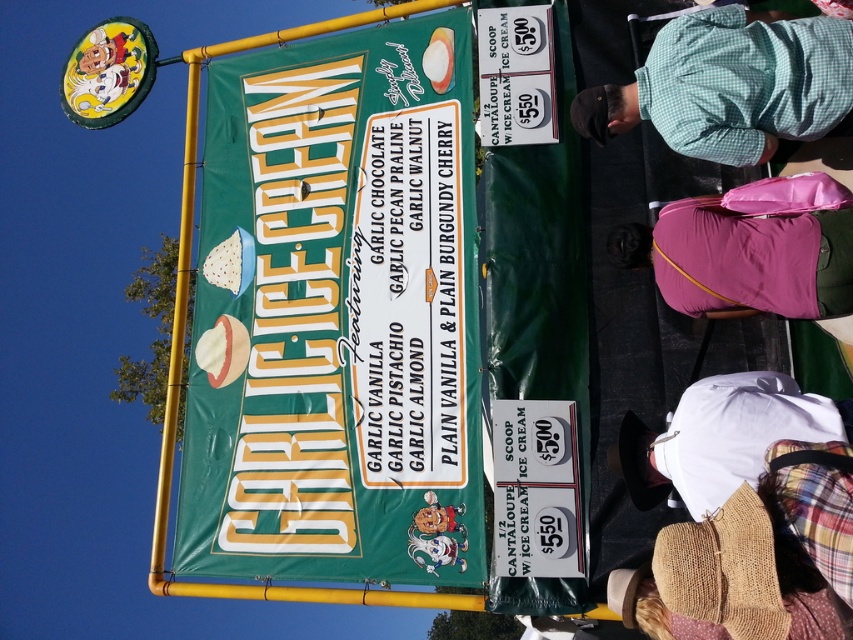
Who is shorter, green fabric banner at upper center or purple fabric bag at lower right?

purple fabric bag at lower right is shorter.

Between green fabric banner at upper center and purple fabric bag at lower right, which one is positioned lower?

Positioned lower is green fabric banner at upper center.

This screenshot has width=853, height=640. Describe the element at coordinates (335, 316) in the screenshot. I see `green fabric banner at upper center` at that location.

Locate an element on the screen. green fabric banner at upper center is located at coordinates (335, 316).

Image resolution: width=853 pixels, height=640 pixels. What are the coordinates of `green fabric banner at upper center` in the screenshot? It's located at (335, 316).

Is point (467, 177) farther from camera compared to point (740, 464)?

Yes, point (467, 177) is behind point (740, 464).

Where is `green fabric banner at upper center`? green fabric banner at upper center is located at coordinates (335, 316).

Is green fabric banner at upper center in front of green checkered shirt at upper right?

No, green fabric banner at upper center is behind green checkered shirt at upper right.

Is green fabric banner at upper center thinner than green checkered shirt at upper right?

No, green fabric banner at upper center is not thinner than green checkered shirt at upper right.

What do you see at coordinates (335, 316) in the screenshot? I see `green fabric banner at upper center` at bounding box center [335, 316].

At what (x,y) coordinates should I click in order to perform the action: click on green fabric banner at upper center. Please return your answer as a coordinate pair (x, y). Image resolution: width=853 pixels, height=640 pixels. Looking at the image, I should click on (335, 316).